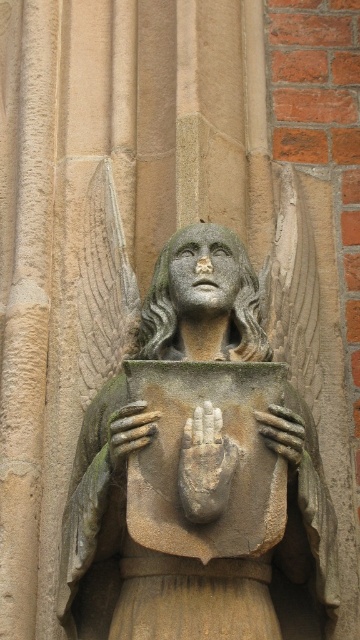
You are standing in front of a stone carving of an angel in a cathedral. You notice a smooth stone hand at center. If you want to take a photo of this hand with your camera, which is 54.28 meters away, will the hand be in focus? Assume your camera can focus up to 50 meters.

The smooth stone hand at center and camera are 54.28 meters apart, which exceeds the camera focus limit of 50 meters. Therefore, the hand will not be in focus.

From the picture: You are an architect designing a new cathedral and want to replicate the angelic figure from the image. The two hands in the carving are critical for holding the book. If your robotic arm has a reach of 16 feet, will it be able to place the book between the smooth stone hand at center and the stone textured hand at center?

The distance between the smooth stone hand at center and the stone textured hand at center is 15.94 feet. Since the robotic arm has a reach of 16 feet, it will be able to place the book between them as the required distance is slightly less than the arm can reach.

You are an architect examining the stone carving of the angel. You notice the stone statue at center and the stone textured hand at center. Which object is positioned lower in the image?

The stone statue at center is located below the stone textured hand at center, so the stone statue at center is positioned lower in the image.